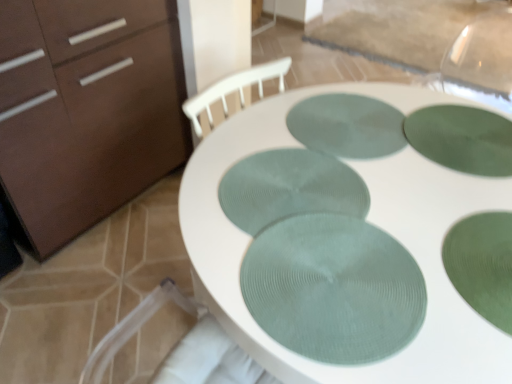
This screenshot has height=384, width=512. I want to click on vacant area that lies between green textured glass plate at upper right, positioned as the 4th glass plate in front-to-back order, and green textured placemat at center, which is the 1th glass plate in back-to-front order, so [x=403, y=149].